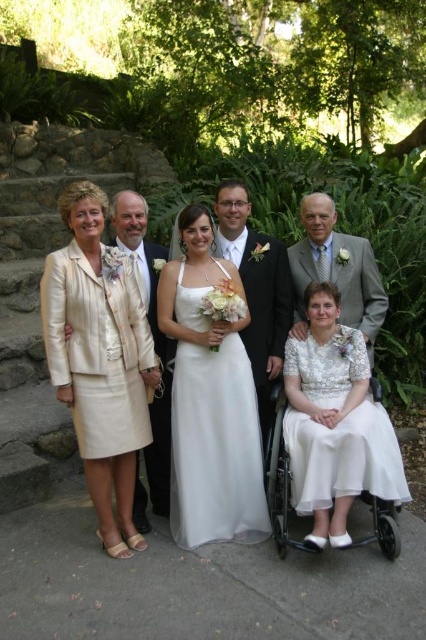
Looking at this image, which of these two, white lace dress at lower center or light beige fabric suit at left, stands taller?

Standing taller between the two is light beige fabric suit at left.

Who is higher up, white lace dress at lower center or light beige fabric suit at left?

Positioned higher is light beige fabric suit at left.

Describe the element at coordinates (344, 458) in the screenshot. I see `white lace dress at lower center` at that location.

The height and width of the screenshot is (640, 426). I want to click on white lace dress at lower center, so coord(344,458).

Between beige satin suit at left and light gray suit at right, which one appears on the right side from the viewer's perspective?

light gray suit at right is more to the right.

Is beige satin suit at left below light gray suit at right?

Yes.

The width and height of the screenshot is (426, 640). I want to click on beige satin suit at left, so click(x=100, y=358).

I want to click on beige satin suit at left, so click(x=100, y=358).

Which of these two, white satin dress at center or light gray suit at right, stands shorter?

light gray suit at right

The height and width of the screenshot is (640, 426). Describe the element at coordinates (215, 445) in the screenshot. I see `white satin dress at center` at that location.

Describe the element at coordinates (215, 445) in the screenshot. I see `white satin dress at center` at that location.

At what (x,y) coordinates should I click in order to perform the action: click on white satin dress at center. Please return your answer as a coordinate pair (x, y). This screenshot has width=426, height=640. Looking at the image, I should click on (215, 445).